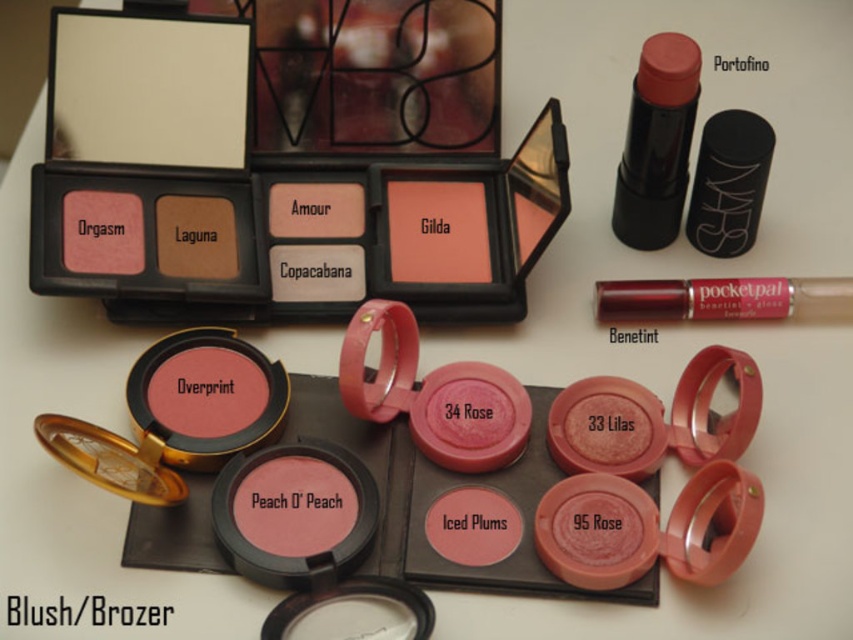
You are a makeup artist preparing for a client. You have two lip products in front of you on the table. One is the matte pink lipstick at upper right and the other is the shiny metallic pocket pal at upper right. Which one is larger in size?

The matte pink lipstick at upper right is bigger than the shiny metallic pocket pal at upper right.

You are organizing a makeup kit and need to place the matte pink lipstick at upper right and the shiny metallic pocket pal at upper right into a compartment that can only fit items narrower than 2 inches. According to the description, which one might not fit?

The shiny metallic pocket pal at upper right has a greater width than the matte pink lipstick at upper right, so it might not fit in the compartment.